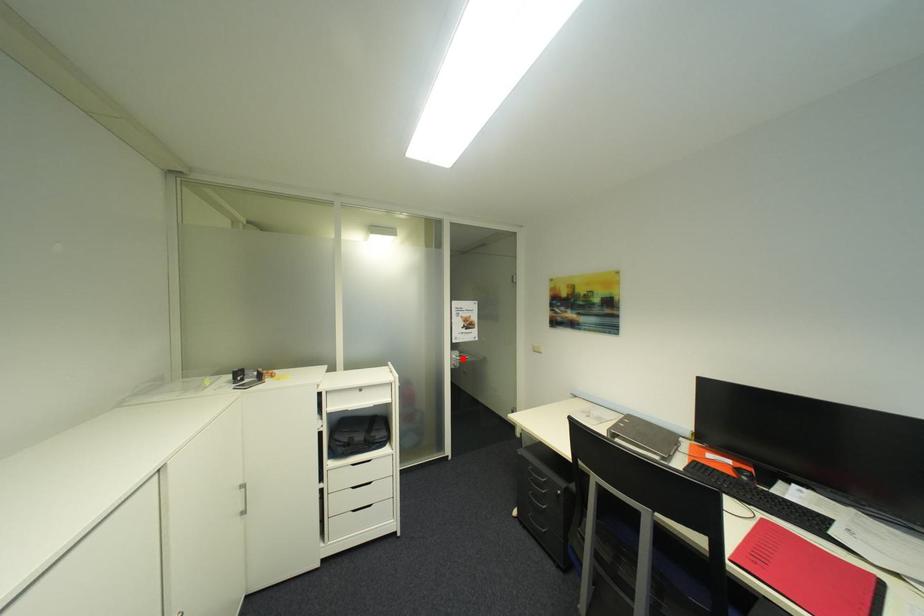
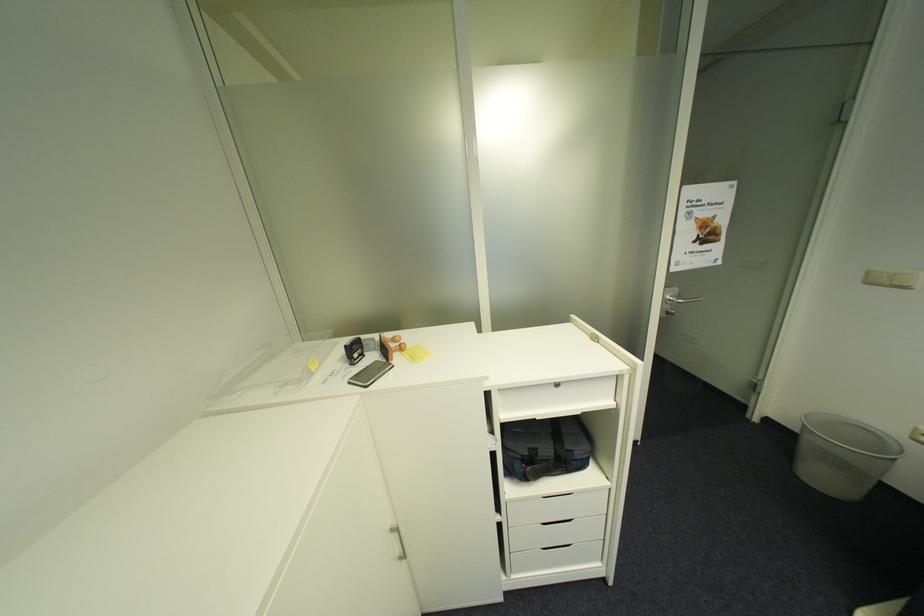
Where in the second image is the point corresponding to the highlighted location from the first image?

(676, 301)